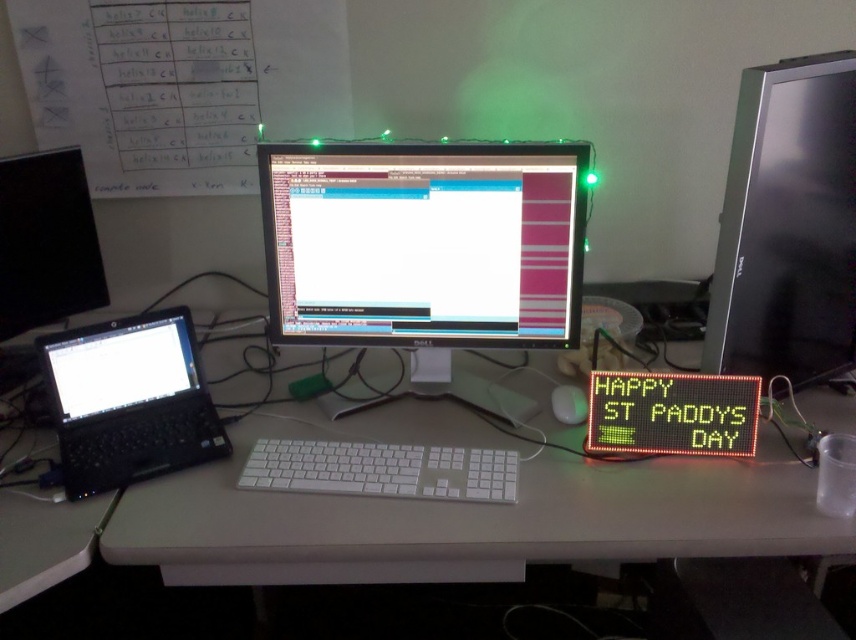
Question: Does white plastic monitor at center have a larger size compared to matte black monitor at right?

Choices:
 (A) no
 (B) yes

Answer: (B)

Question: Is black glossy monitor at left below white plastic keyboard at center?

Choices:
 (A) no
 (B) yes

Answer: (A)

Question: Which point appears closest to the camera in this image?

Choices:
 (A) (556, 412)
 (B) (455, 291)
 (C) (783, 99)

Answer: (C)

Question: Considering the real-world distances, which object is farthest from the white plastic keyboard at center?

Choices:
 (A) matte black monitor at right
 (B) white plastic monitor at center
 (C) black plastic mouse at center

Answer: (A)

Question: Is white plastic monitor at center below black plastic mouse at center?

Choices:
 (A) no
 (B) yes

Answer: (B)

Question: Which point appears closest to the camera in this image?

Choices:
 (A) (538, 387)
 (B) (191, 445)
 (C) (569, 387)
 (D) (340, 264)

Answer: (B)